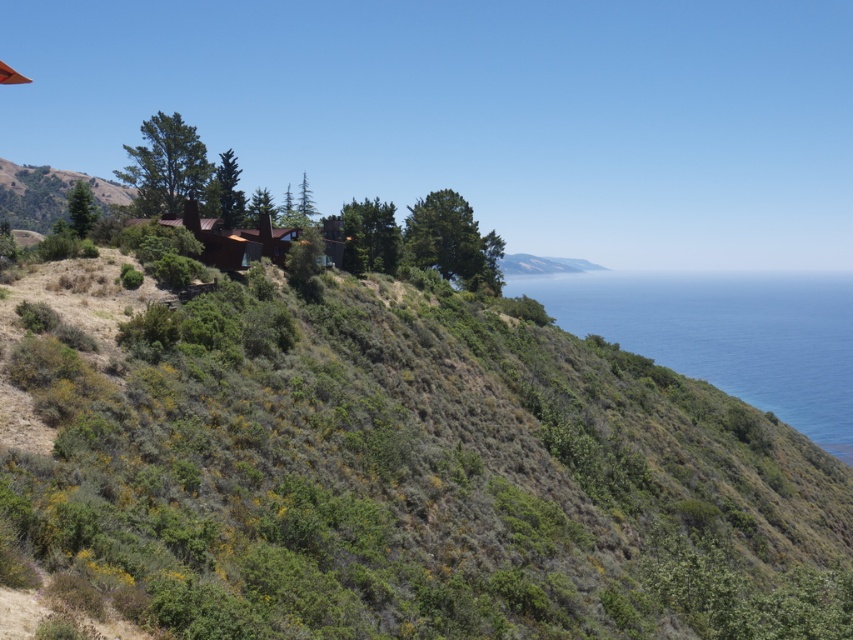
Is green shrubbery at upper center in front of blue water at right?

Yes, green shrubbery at upper center is closer to the viewer.

Between green shrubbery at upper center and blue water at right, which one appears on the right side from the viewer's perspective?

Positioned to the right is blue water at right.

Identify the location of green shrubbery at upper center. The image size is (853, 640). (402, 476).